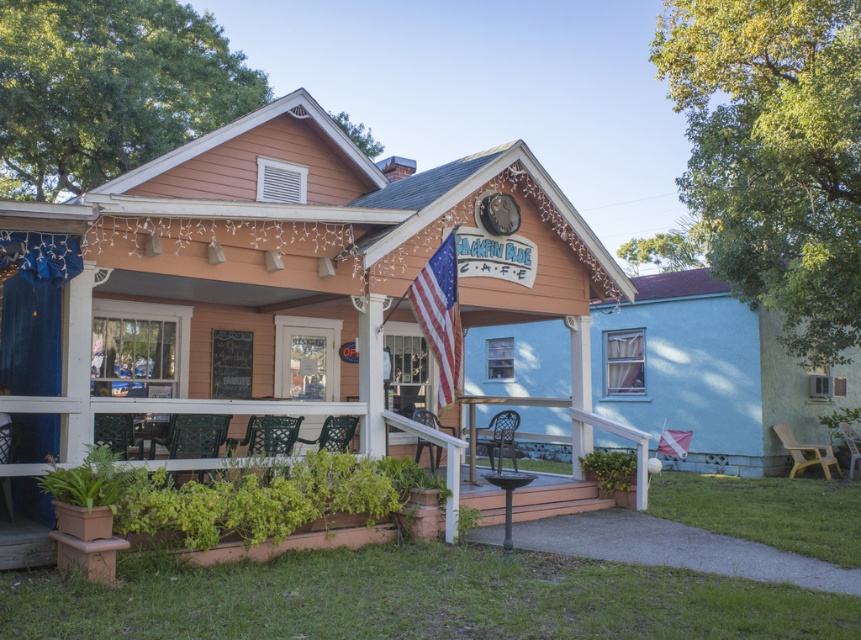
Question: Which point appears farthest from the camera in this image?

Choices:
 (A) (164, 410)
 (B) (672, 438)

Answer: (B)

Question: Which point is farther to the camera?

Choices:
 (A) (430, 282)
 (B) (679, 454)

Answer: (B)

Question: Which object is closer to the camera taking this photo?

Choices:
 (A) terracotta pot at lower left
 (B) american flag at center
 (C) white fabric flag at center

Answer: (A)

Question: Does terracotta pot at lower left appear on the left side of white fabric flag at center?

Choices:
 (A) yes
 (B) no

Answer: (A)

Question: Is terracotta pot at lower left in front of white fabric flag at center?

Choices:
 (A) yes
 (B) no

Answer: (A)

Question: Is terracotta pot at lower left thinner than american flag at center?

Choices:
 (A) no
 (B) yes

Answer: (A)